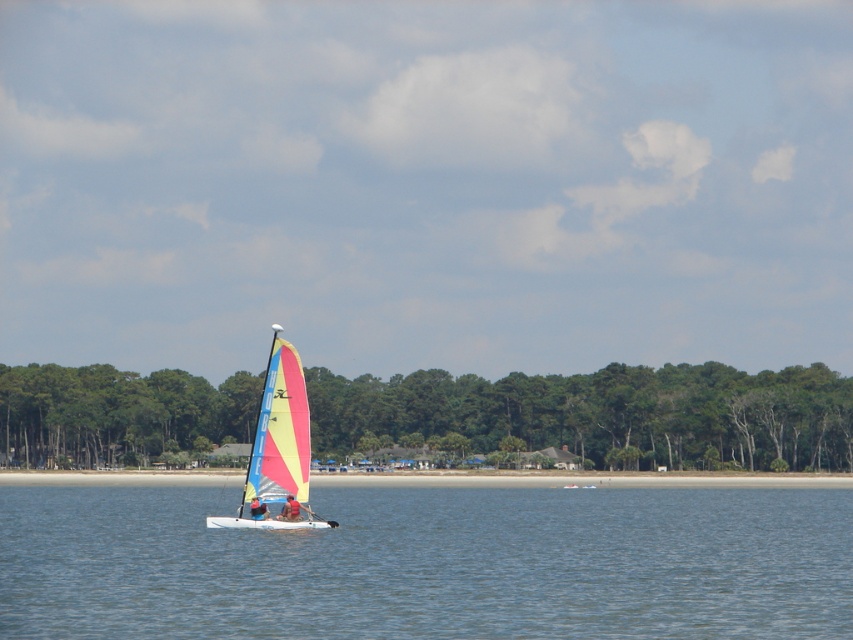
Question: Can you confirm if clear blue water at center is positioned to the right of smooth tan skin at center?

Choices:
 (A) no
 (B) yes

Answer: (B)

Question: Which point is closer to the camera?

Choices:
 (A) (286, 403)
 (B) (252, 513)
 (C) (627, 492)

Answer: (B)

Question: Among these points, which one is nearest to the camera?

Choices:
 (A) (91, 496)
 (B) (260, 516)
 (C) (293, 500)
 (D) (270, 474)

Answer: (B)

Question: Does multicolored fabric sailboat at center appear on the left side of smooth tan skin at center?

Choices:
 (A) yes
 (B) no

Answer: (A)

Question: Is multicolored fabric sailboat at center thinner than smooth tan skin at center?

Choices:
 (A) no
 (B) yes

Answer: (A)

Question: Which object appears farthest from the camera in this image?

Choices:
 (A) multicolored fabric sailboat at center
 (B) smooth tan skin at center
 (C) clear blue water at center

Answer: (B)